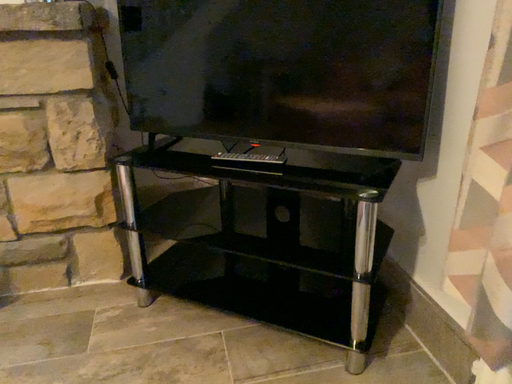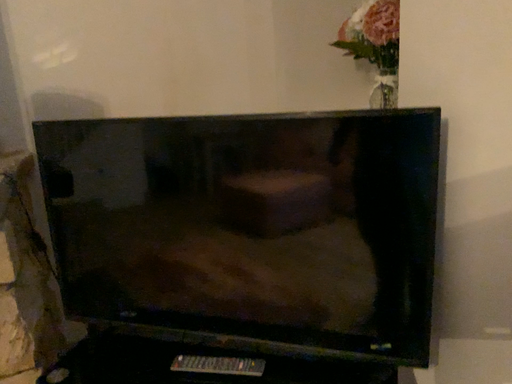
Question: Which way did the camera rotate in the video?

Choices:
 (A) rotated downward
 (B) rotated upward

Answer: (B)